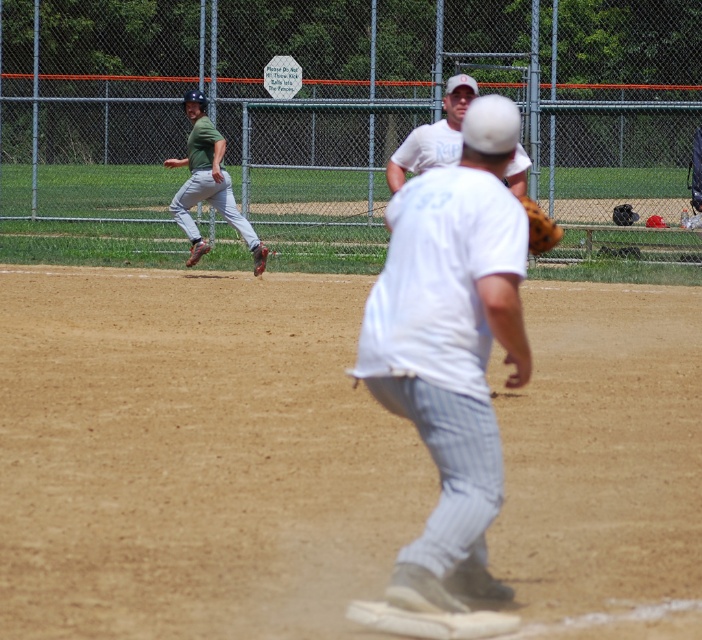
Question: Which of the following is the closest to the observer?

Choices:
 (A) brown leather glove at center
 (B) green fabric baseball uniform at upper left
 (C) white pinstriped pants at center

Answer: (C)

Question: Among these objects, which one is farthest from the camera?

Choices:
 (A) white cotton shirt at upper center
 (B) brown leather glove at center

Answer: (A)

Question: Can you confirm if white pinstriped pants at center is smaller than brown leather glove at center?

Choices:
 (A) no
 (B) yes

Answer: (A)

Question: Is white cotton shirt at upper center positioned in front of brown leather glove at center?

Choices:
 (A) no
 (B) yes

Answer: (A)

Question: Considering the relative positions of white pinstriped pants at center and brown leather glove at center in the image provided, where is white pinstriped pants at center located with respect to brown leather glove at center?

Choices:
 (A) below
 (B) above

Answer: (A)

Question: Which object appears farthest from the camera in this image?

Choices:
 (A) white cotton shirt at upper center
 (B) brown leather glove at center

Answer: (A)